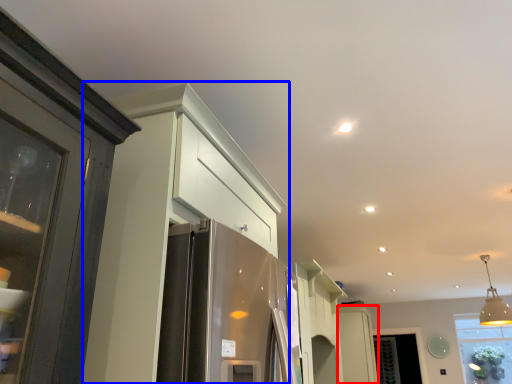
Question: Which point is closer to the camera, cabinetry (highlighted by a red box) or cabinetry (highlighted by a blue box)?

Choices:
 (A) cabinetry
 (B) cabinetry

Answer: (B)